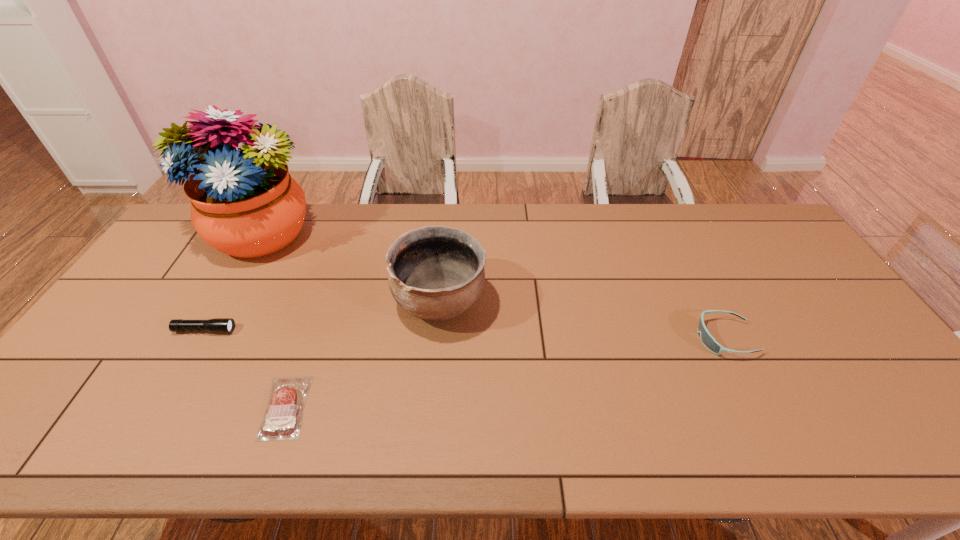
Where is `free point between the nearest object and the pottery`? free point between the nearest object and the pottery is located at coordinates (363, 354).

This screenshot has width=960, height=540. What are the coordinates of `free point between the rightmost object and the tallest object` in the screenshot? It's located at (492, 286).

At what (x,y) coordinates should I click in order to perform the action: click on free spot between the rightmost object and the flower arrangement. Please return your answer as a coordinate pair (x, y). This screenshot has width=960, height=540. Looking at the image, I should click on (492, 286).

Find the location of a particular element. Image resolution: width=960 pixels, height=540 pixels. free spot between the flashlight and the shortest object is located at coordinates (245, 369).

Locate an element on the screen. The image size is (960, 540). object identified as the closest to the nearest object is located at coordinates (435, 273).

Identify which object is the third closest to the flashlight. Please provide its 2D coordinates. Your answer should be formatted as a tuple, i.e. [(x, y)], where the tuple contains the x and y coordinates of a point satisfying the conditions above.

[(435, 273)]

Identify the location of vacant point that satisfies the following two spatial constraints: 1. on the front side of the flower arrangement; 2. on the left side of the fourth shortest object. (219, 302).

Locate an element on the screen. free space that satisfies the following two spatial constraints: 1. on the back side of the second tallest object; 2. on the left side of the steak is located at coordinates (323, 302).

Where is `vacant position in the image that satisfies the following two spatial constraints: 1. at the lens end of the third object from left to right; 2. on the left side of the fourth tallest object`? The image size is (960, 540). vacant position in the image that satisfies the following two spatial constraints: 1. at the lens end of the third object from left to right; 2. on the left side of the fourth tallest object is located at coordinates click(x=161, y=407).

You are a GUI agent. You are given a task and a screenshot of the screen. Output one action in this format:
    pyautogui.click(x=<x>, y=<y>)
    Task: Click on the free space in the image that satisfies the following two spatial constraints: 1. at the lens end of the nearest object; 2. on the right side of the second shortest object
    The image size is (960, 540).
    Given the screenshot: What is the action you would take?
    pyautogui.click(x=161, y=407)